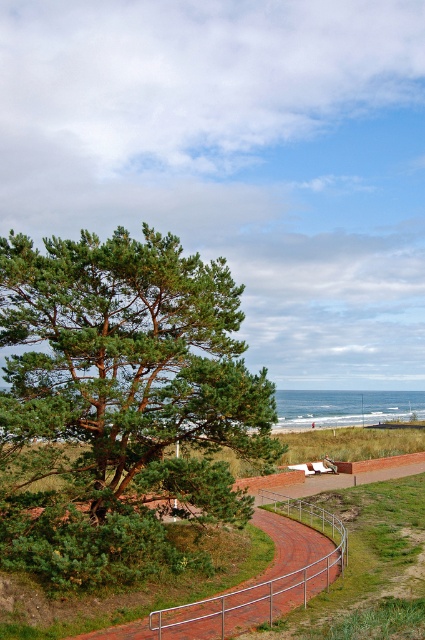
Image resolution: width=425 pixels, height=640 pixels. Find the location of `green needle-like at center`. green needle-like at center is located at coordinates (121, 403).

Is green needle-like at center to the right of brick paved path at lower center from the viewer's perspective?

Incorrect, green needle-like at center is not on the right side of brick paved path at lower center.

Who is more forward, (x=113, y=460) or (x=283, y=566)?

Point (x=113, y=460) is in front.

This screenshot has width=425, height=640. Identify the location of green needle-like at center. (121, 403).